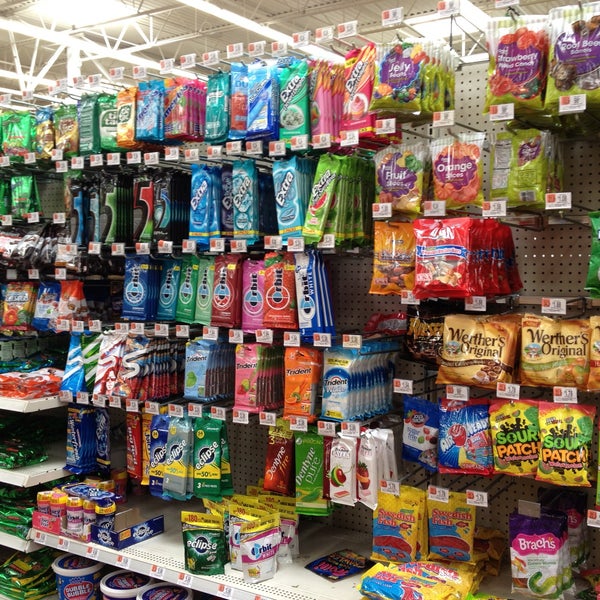
Where is `empty space/rack`? This screenshot has height=600, width=600. empty space/rack is located at coordinates (466, 91), (553, 263), (349, 278), (243, 439), (153, 547), (300, 585), (582, 160).